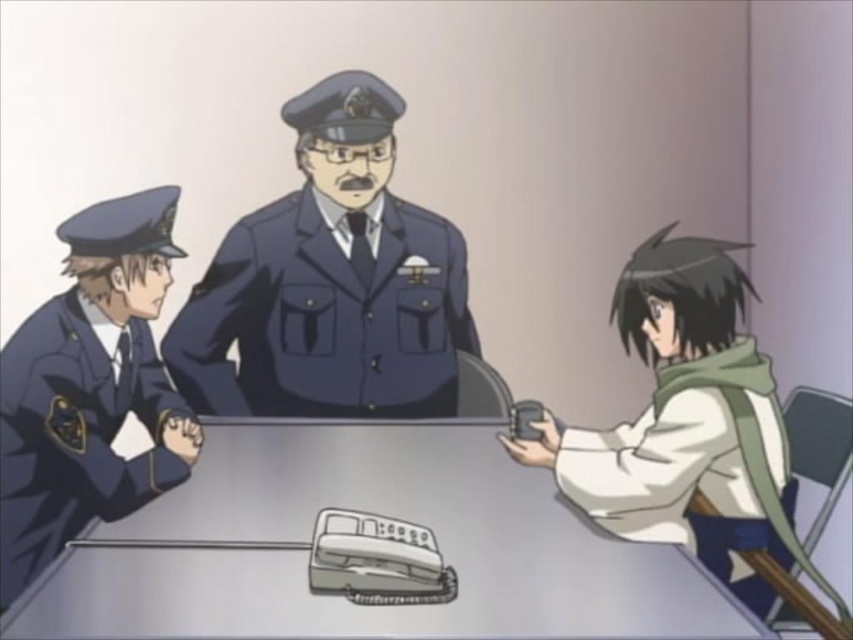
You are a character in the scene and need to place a small notebook on the metallic gray table at center without it falling off. Considering the size of the matte blue uniform at left, will the table have enough space?

The metallic gray table at center is bigger than the matte blue uniform at left, so there should be sufficient space to place the notebook without it falling off.

You are observing an animated interrogation scene. There is a metallic gray table at center and a matte blue uniform at center. Which object is positioned to the right of the other?

The metallic gray table at center is to the right of the matte blue uniform at center.

You are a character in the scene and want to move from point A at point (x=387, y=202) to point B at point (x=22, y=570). Which direction should you move to get closer to point B?

To move from point A at point (x=387, y=202) to point B at point (x=22, y=570), you should move towards the lower right direction since point B is located at a lower and more rightward position compared to point A.